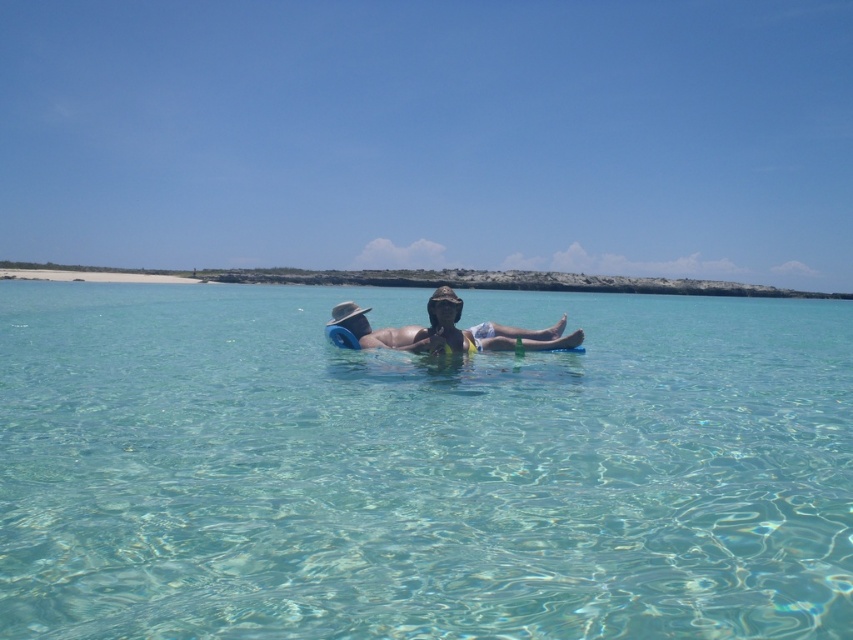
Who is more forward, [828,632] or [346,339]?

Point [828,632] is more forward.

Does clear water at center have a greater width compared to matte blue pool float at center?

Correct, the width of clear water at center exceeds that of matte blue pool float at center.

Which is behind, point (792, 621) or point (364, 323)?

Positioned behind is point (364, 323).

Locate an element on the screen. This screenshot has height=640, width=853. clear water at center is located at coordinates (421, 468).